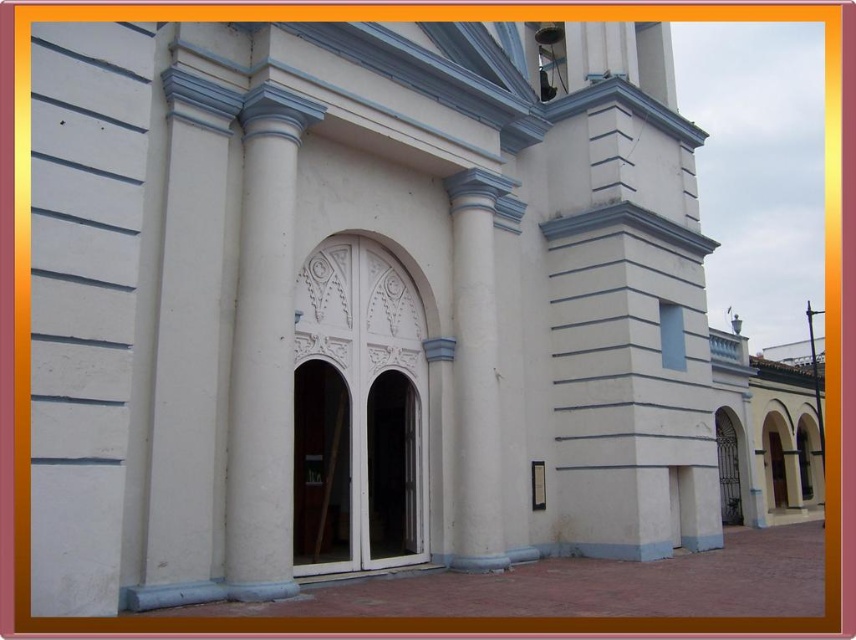
You are standing in front of the building and notice two points marked on the facade. The first point is at coordinates point [266,344] and the second is at point [485,432]. Which point is closer to your current position?

Point [266,344] is closer to the camera than point [485,432], so the first point is closer to your current position.